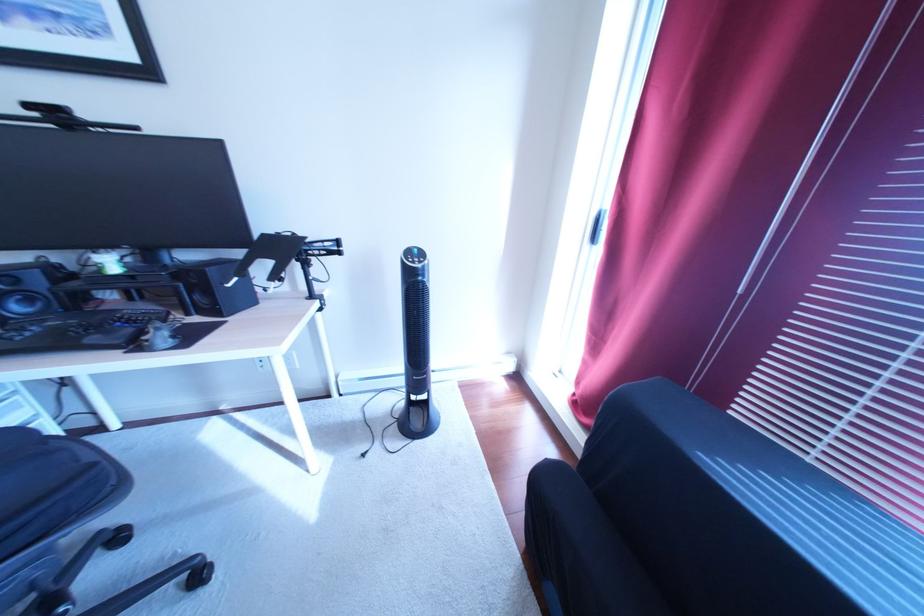
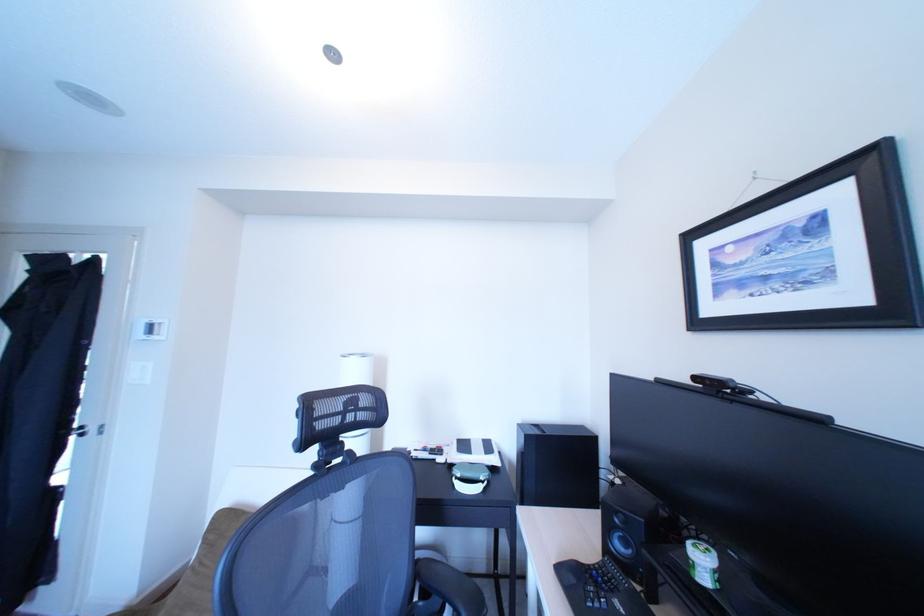
Question: Based on the continuous images, in which direction is the camera rotating? Reply with the corresponding letter.

Choices:
 (A) Left
 (B) Right
 (C) Up
 (D) Down

Answer: (A)